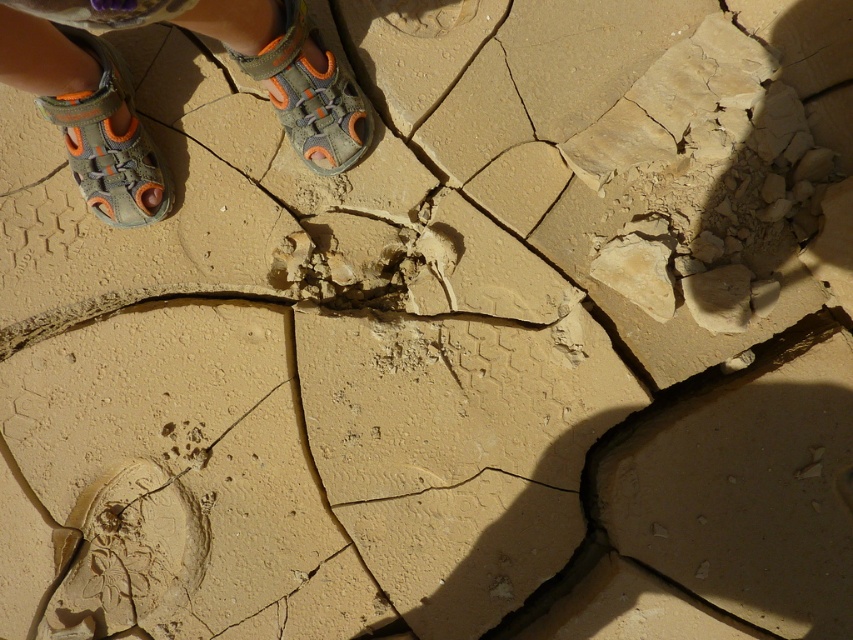
Is the position of gray fabric sandals at upper left less distant than that of gray fabric sandal at left?

Yes, gray fabric sandals at upper left is closer to the viewer.

Can you confirm if gray fabric sandals at upper left is positioned above gray fabric sandal at left?

Correct, gray fabric sandals at upper left is located above gray fabric sandal at left.

Is point (300, 3) in front of point (131, 141)?

That is True.

Locate an element on the screen. The width and height of the screenshot is (853, 640). gray fabric sandals at upper left is located at coordinates (131, 93).

Based on the photo, is gray fabric sandal at left to the left of gray fabric sandal at upper center from the viewer's perspective?

Yes, gray fabric sandal at left is to the left of gray fabric sandal at upper center.

Who is higher up, gray fabric sandal at left or gray fabric sandal at upper center?

gray fabric sandal at upper center

Identify the location of gray fabric sandal at left. (109, 141).

Who is positioned more to the right, gray fabric sandals at upper left or gray fabric sandal at upper center?

From the viewer's perspective, gray fabric sandal at upper center appears more on the right side.

Who is taller, gray fabric sandals at upper left or gray fabric sandal at upper center?

gray fabric sandals at upper left is taller.

Where is `gray fabric sandals at upper left`? gray fabric sandals at upper left is located at coordinates (131, 93).